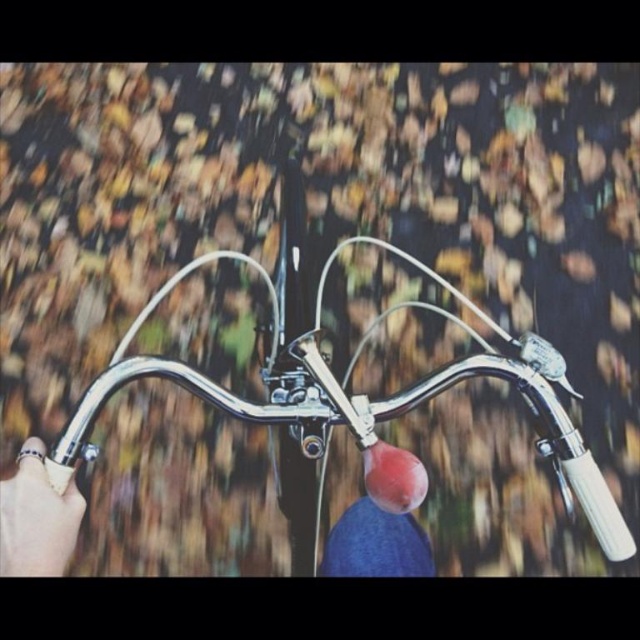
Who is positioned more to the left, polished chrome bicycle handlebars at center or gold metallic ring at lower left?

gold metallic ring at lower left

Which is below, polished chrome bicycle handlebars at center or gold metallic ring at lower left?

Positioned lower is gold metallic ring at lower left.

Does point (106, 371) lie behind point (1, 545)?

Yes.

Find the location of a particular element. Image resolution: width=640 pixels, height=640 pixels. polished chrome bicycle handlebars at center is located at coordinates (356, 406).